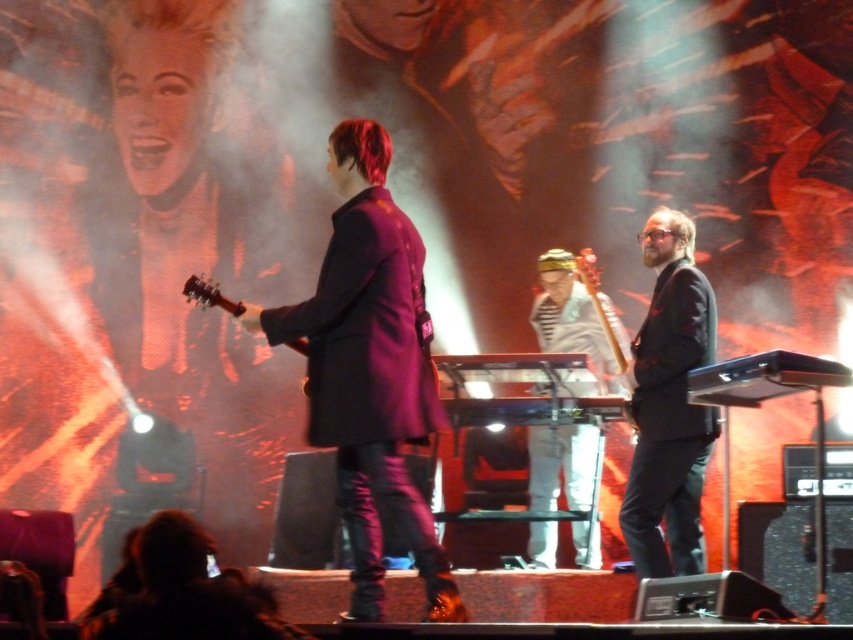
You are a photographer in the audience of this concert. You want to take a photo of the black matte suit at right and the white striped shirt at center. From your perspective, which one is positioned higher in the frame?

The black matte suit at right is located above the white striped shirt at center, so it is positioned higher in the frame.